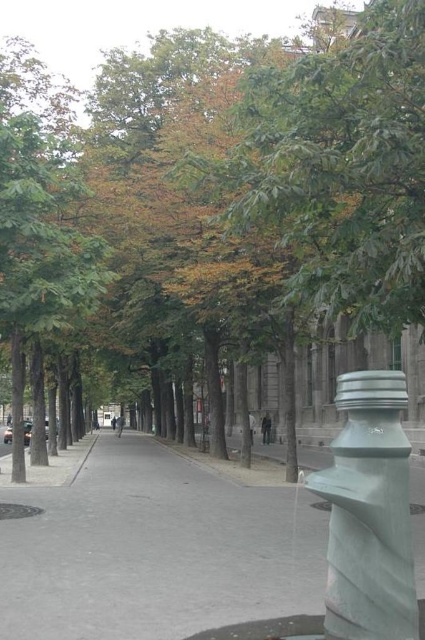
You are standing on the sidewalk in the urban street scene. There are two points marked on the ground ahead of you. The first point is at coordinates point (44,209) and the second is at point (404,552). If you walk straight ahead, which point will you encounter first?

Point (404,552) will be encountered first because it is in front of point (44,209) according to their positions.

You are a delivery person with a 1.5 meter wide cart. You want to navigate along the gray concrete pavement at center while avoiding the satin gray hydrant at center right. Can your cart fit on the pavement without hitting the hydrant?

The gray concrete pavement at center might be wider than satin gray hydrant at center right, so it is possible that the pavement is wide enough for the 1.5 meter cart. However, without exact measurements, there is uncertainty about whether there will be enough space to avoid the hydrant safely.